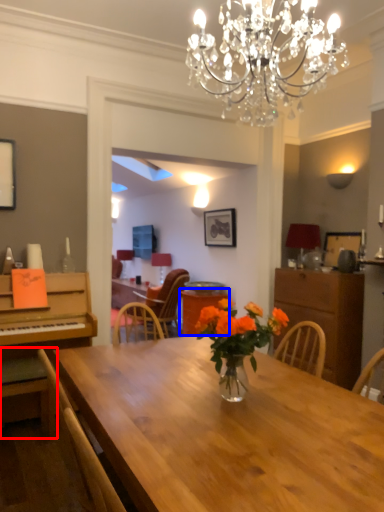
Question: Which object is further to the camera taking this photo, chair (highlighted by a red box) or table (highlighted by a blue box)?

Choices:
 (A) chair
 (B) table

Answer: (B)